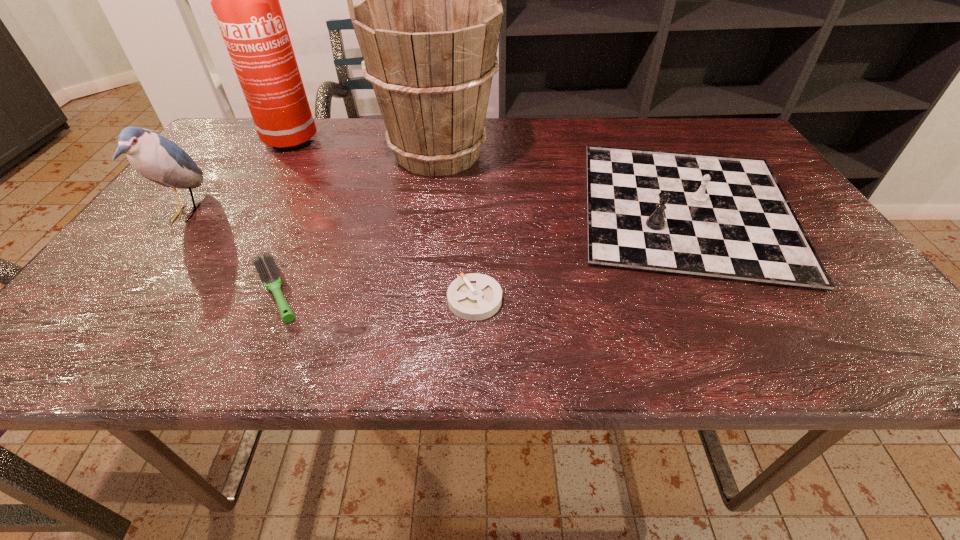
Where is `vacant position in the image that satisfies the following two spatial constraints: 1. on the back side of the shortest object; 2. at the nozzle of the fire extinguisher`? This screenshot has height=540, width=960. vacant position in the image that satisfies the following two spatial constraints: 1. on the back side of the shortest object; 2. at the nozzle of the fire extinguisher is located at coordinates (476, 140).

Where is `free space that satisfies the following two spatial constraints: 1. at the tip of the second shortest object's beak; 2. on the right side of the fourth shortest object`? Image resolution: width=960 pixels, height=540 pixels. free space that satisfies the following two spatial constraints: 1. at the tip of the second shortest object's beak; 2. on the right side of the fourth shortest object is located at coordinates coord(128,291).

Image resolution: width=960 pixels, height=540 pixels. Find the location of `blank area in the image that satisfies the following two spatial constraints: 1. on the front side of the bucket; 2. at the tip of the bird's beak`. blank area in the image that satisfies the following two spatial constraints: 1. on the front side of the bucket; 2. at the tip of the bird's beak is located at coordinates (429, 213).

At what (x,y) coordinates should I click in order to perform the action: click on free region that satisfies the following two spatial constraints: 1. at the nozzle of the fire extinguisher; 2. on the back side of the fifth shortest object. Please return your answer as a coordinate pair (x, y). Looking at the image, I should click on (271, 153).

Find the location of `free space that satisfies the following two spatial constraints: 1. at the nozzle of the fire extinguisher; 2. on the right side of the second tallest object`. free space that satisfies the following two spatial constraints: 1. at the nozzle of the fire extinguisher; 2. on the right side of the second tallest object is located at coordinates (271, 153).

Find the location of a particular element. This screenshot has height=540, width=960. vacant area in the image that satisfies the following two spatial constraints: 1. at the nozzle of the shortest object; 2. on the left side of the fire extinguisher is located at coordinates (179, 300).